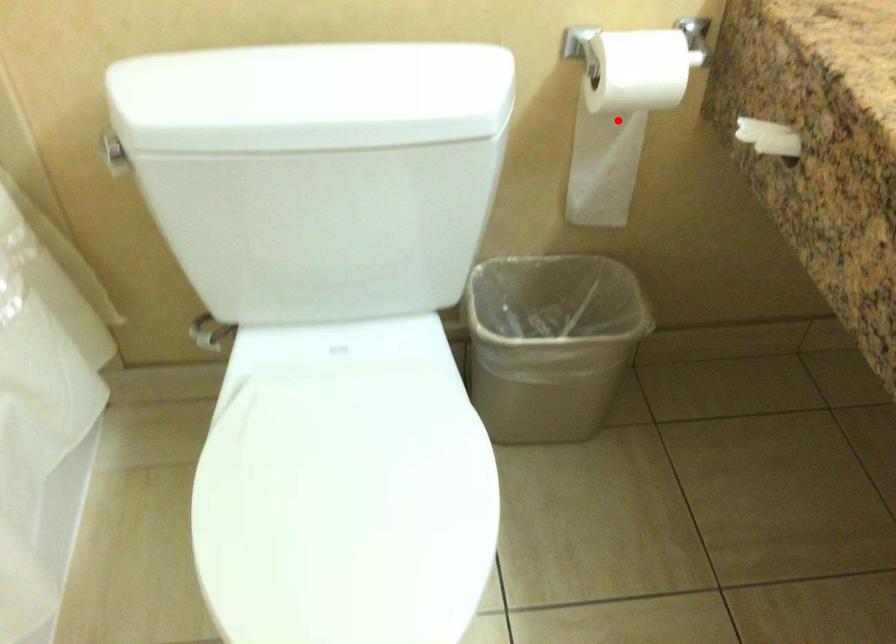
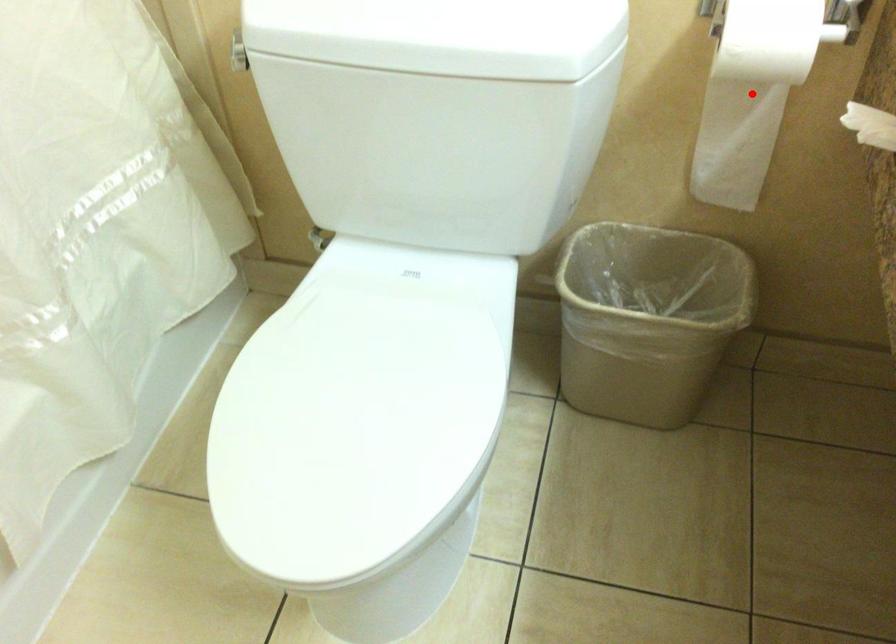
I am providing you with two images of the same scene from different viewpoints. A red point is marked on the first image and another point is marked on the second image. Do the highlighted points in image1 and image2 indicate the same real-world spot?

Yes